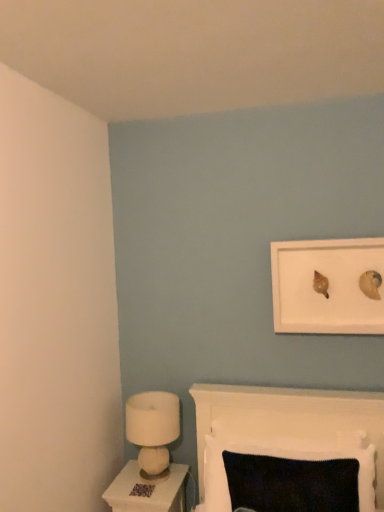
Question: From the image's perspective, is brown textured carpet at lower center located above or below knitted fabric cushion at lower center?

Choices:
 (A) above
 (B) below

Answer: (B)

Question: From a real-world perspective, relative to knitted fabric cushion at lower center, is brown textured carpet at lower center vertically above or below?

Choices:
 (A) below
 (B) above

Answer: (A)

Question: Which object is positioned closest to the white felt lamp at lower left?

Choices:
 (A) knitted fabric cushion at lower center
 (B) brown textured carpet at lower center
 (C) white glossy nightstand at lower left
 (D) white matte picture frame at upper right

Answer: (C)

Question: Which of these objects is positioned farthest from the white matte picture frame at upper right?

Choices:
 (A) white felt lamp at lower left
 (B) white glossy nightstand at lower left
 (C) knitted fabric cushion at lower center
 (D) brown textured carpet at lower center

Answer: (D)